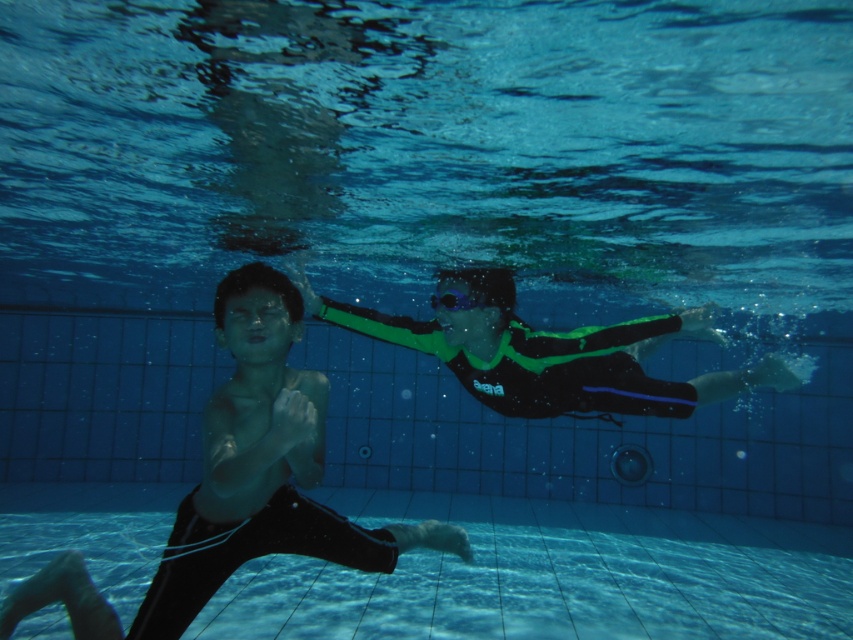
Is transparent plastic swimmer at lower center wider than green matte wetsuit at center?

No.

The height and width of the screenshot is (640, 853). Identify the location of transparent plastic swimmer at lower center. (552, 577).

Describe the element at coordinates (553, 353) in the screenshot. I see `green matte wetsuit at center` at that location.

Does green matte wetsuit at center appear over transparent plastic goggles at center?

Actually, green matte wetsuit at center is below transparent plastic goggles at center.

Measure the distance between point (633, 320) and camera.

The distance of point (633, 320) from camera is 3.77 meters.

Where is `green matte wetsuit at center`? The height and width of the screenshot is (640, 853). green matte wetsuit at center is located at coordinates (553, 353).

Is black matte wetsuit at center taller than transparent plastic goggles at center?

Indeed, black matte wetsuit at center has a greater height compared to transparent plastic goggles at center.

Between black matte wetsuit at center and transparent plastic goggles at center, which one appears on the left side from the viewer's perspective?

Positioned to the left is black matte wetsuit at center.

Locate an element on the screen. The height and width of the screenshot is (640, 853). black matte wetsuit at center is located at coordinates (241, 483).